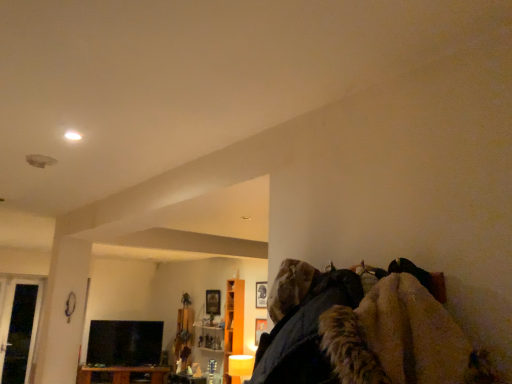
Question: Considering the relative sizes of orange wood cabinet at center and brown wood cabinet at lower left in the image provided, is orange wood cabinet at center bigger than brown wood cabinet at lower left?

Choices:
 (A) yes
 (B) no

Answer: (B)

Question: Is orange wood cabinet at center to the left of brown wood cabinet at lower left from the viewer's perspective?

Choices:
 (A) yes
 (B) no

Answer: (B)

Question: From a real-world perspective, is orange wood cabinet at center located beneath brown wood cabinet at lower left?

Choices:
 (A) no
 (B) yes

Answer: (A)

Question: Is orange wood cabinet at center shorter than brown wood cabinet at lower left?

Choices:
 (A) no
 (B) yes

Answer: (A)

Question: From the image's perspective, would you say orange wood cabinet at center is shown under brown wood cabinet at lower left?

Choices:
 (A) yes
 (B) no

Answer: (B)

Question: Based on their sizes in the image, would you say brown wood cabinet at lower left is bigger or smaller than transparent glass door at left?

Choices:
 (A) big
 (B) small

Answer: (A)

Question: Is point (115, 372) positioned closer to the camera than point (39, 299)?

Choices:
 (A) farther
 (B) closer

Answer: (A)

Question: In the image, is brown wood cabinet at lower left on the left side or the right side of transparent glass door at left?

Choices:
 (A) left
 (B) right

Answer: (B)

Question: From the image's perspective, relative to transparent glass door at left, is brown wood cabinet at lower left above or below?

Choices:
 (A) below
 (B) above

Answer: (A)

Question: From the image's perspective, is transparent glass door at left above or below orange wood cabinet at center?

Choices:
 (A) below
 (B) above

Answer: (A)

Question: Based on their positions, is transparent glass door at left located to the left or right of orange wood cabinet at center?

Choices:
 (A) left
 (B) right

Answer: (A)

Question: From their relative heights in the image, would you say transparent glass door at left is taller or shorter than orange wood cabinet at center?

Choices:
 (A) tall
 (B) short

Answer: (A)

Question: Is transparent glass door at left in front of or behind orange wood cabinet at center in the image?

Choices:
 (A) behind
 (B) front

Answer: (A)

Question: Is black glossy tv at lower left inside or outside of brown wood cabinet at lower left?

Choices:
 (A) outside
 (B) inside

Answer: (A)

Question: Is point (90, 342) closer or farther from the camera than point (147, 382)?

Choices:
 (A) farther
 (B) closer

Answer: (A)